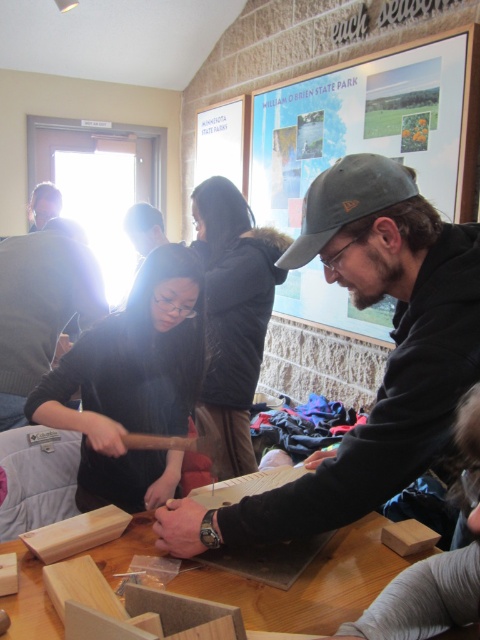
You are a photographer standing at the back of the workshop. You want to take a photo of the two people working at the table. The camera you are using has a maximum focus range of 45 centimeters. Can you capture both the matte black cap at center and the matte black sweater at center in focus without moving the camera?

The matte black cap at center is 44.56 centimeters away from the matte black sweater at center. Since the distance between them is less than the camera maximum focus range of 45 centimeters, you can capture both in focus without moving the camera.

You are a photographer trying to capture a closeup of the matte black cap at center in the workshop scene. The camera you are using has a focal length of 50mm. To ensure the cap fills the frame, you need to be within 1 meter of it. Given that you are currently standing 3 meters away from the cap, can you move closer to achieve the desired shot without violating the 1 meter minimum distance requirement?

The matte black cap at center is located at point coordinates (386, 362). Since you are currently 3 meters away and need to be within 1 meter, you can move closer to within 1 meter to capture the closeup.